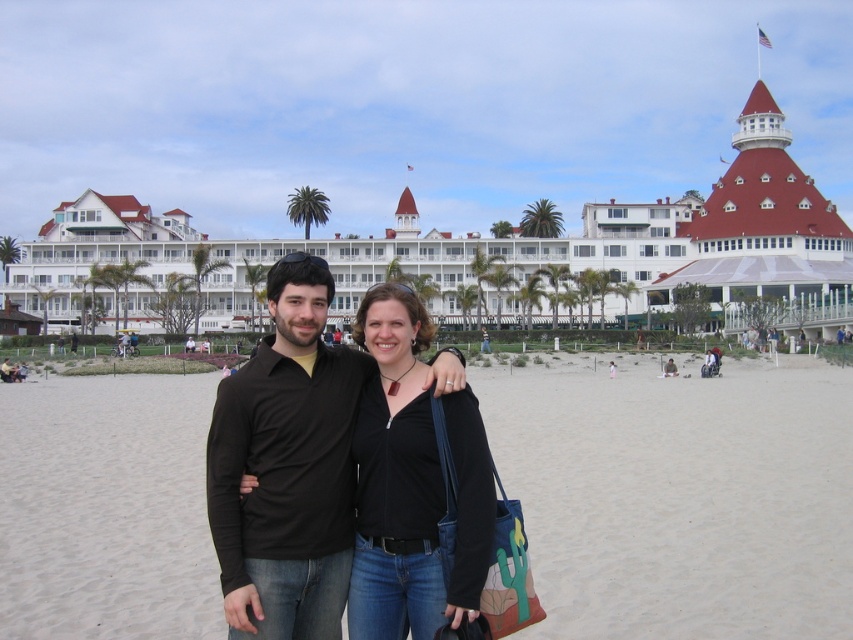
You are a photographer taking a picture of the beach scene. You notice the white sand at center and the black matte shirt at center. Which object is located to the right of the other?

The white sand at center is positioned on the right side of black matte shirt at center, so the white sand at center is to the right of the black matte shirt at center.

Based on the photo, you are a photographer trying to capture the black matte shirt at center and the black matte jacket at center in a photo. Since both are black, you want to ensure the shirt is visible. According to the scene description, which object is covering part of the other?

Result: The black matte shirt at center is positioned over black matte jacket at center, so the shirt is covering part of the jacket.